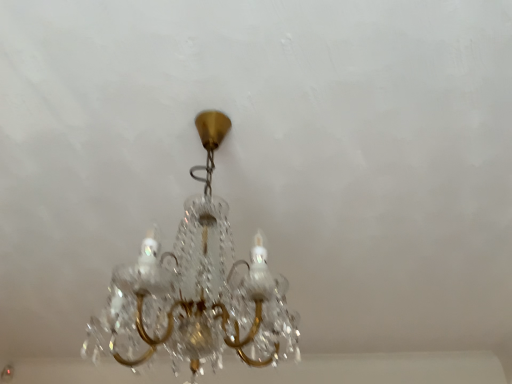
Describe the element at coordinates (197, 290) in the screenshot. I see `clear crystal chandelier at center` at that location.

Where is `clear crystal chandelier at center`? This screenshot has width=512, height=384. clear crystal chandelier at center is located at coordinates (197, 290).

The height and width of the screenshot is (384, 512). I want to click on clear crystal chandelier at center, so click(197, 290).